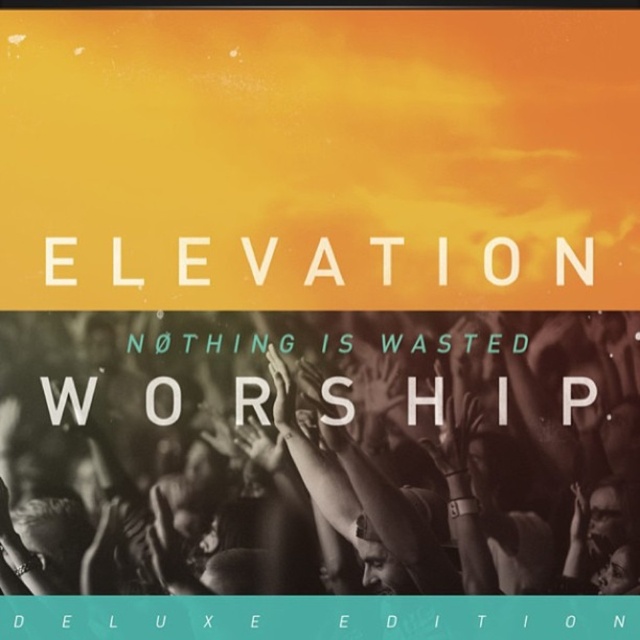
Question: Can you confirm if black matte hands at center is wider than white matte text at center?

Choices:
 (A) no
 (B) yes

Answer: (B)

Question: Is black matte hands at center closer to camera compared to white matte text at center?

Choices:
 (A) no
 (B) yes

Answer: (B)

Question: Which object is farther from the camera taking this photo?

Choices:
 (A) black matte hands at center
 (B) white matte text at center

Answer: (B)

Question: Which point appears closest to the camera in this image?

Choices:
 (A) (336, 257)
 (B) (577, 442)

Answer: (B)

Question: Does black matte hands at center come in front of white matte text at center?

Choices:
 (A) yes
 (B) no

Answer: (A)